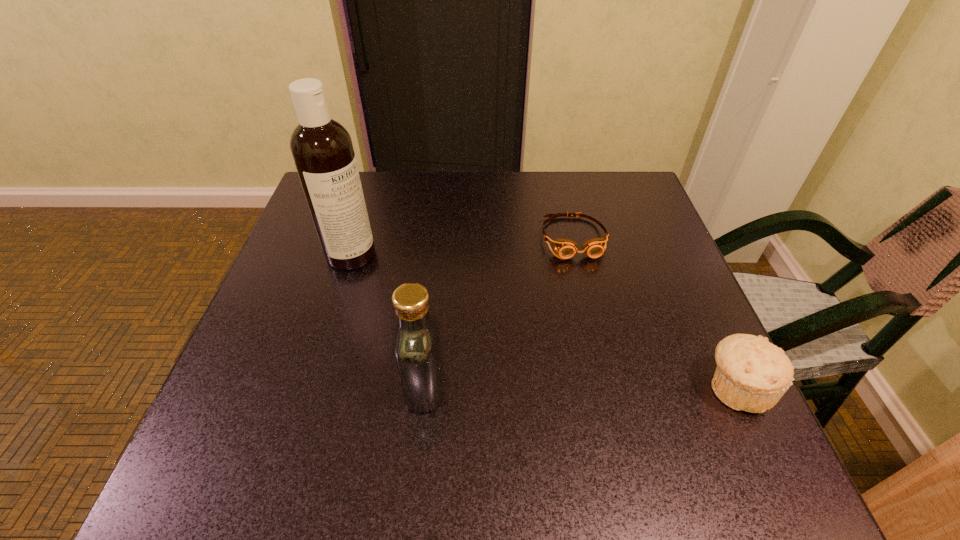
You are a GUI agent. You are given a task and a screenshot of the screen. Output one action in this format:
    pyautogui.click(x=<x>, y=<y>)
    Task: Click on the muffin situated at the near edge
    
    Given the screenshot: What is the action you would take?
    752,374

Image resolution: width=960 pixels, height=540 pixels. Find the location of `object at the left edge`. object at the left edge is located at coordinates 322,149.

Where is `muffin present at the right edge`? The height and width of the screenshot is (540, 960). muffin present at the right edge is located at coordinates (752, 374).

Locate an element on the screen. The width and height of the screenshot is (960, 540). goggles located in the right edge section of the desktop is located at coordinates (565, 248).

Find the location of `object at the far right corner`. object at the far right corner is located at coordinates (565, 248).

The width and height of the screenshot is (960, 540). I want to click on object positioned at the near right corner, so click(752, 374).

This screenshot has width=960, height=540. I want to click on vacant space at the far edge of the desktop, so click(572, 213).

You are a GUI agent. You are given a task and a screenshot of the screen. Output one action in this format:
    pyautogui.click(x=<x>, y=<y>)
    Task: Click on the vacant space at the near edge of the desktop
    Image resolution: width=960 pixels, height=540 pixels.
    Given the screenshot: What is the action you would take?
    pyautogui.click(x=525, y=395)

At what (x,y) coordinates should I click in order to perform the action: click on free spot at the left edge of the desktop. Please return your answer as a coordinate pair (x, y). The image size is (960, 540). Looking at the image, I should click on point(348,287).

In the image, there is a desktop. At what (x,y) coordinates should I click in order to perform the action: click on vacant area at the right edge. Please return your answer as a coordinate pair (x, y). Looking at the image, I should click on (656, 298).